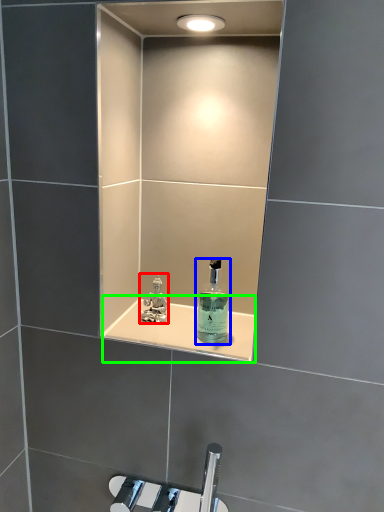
Question: Considering the real-world distances, which object is closest to perfume (highlighted by a red box)? bottle (highlighted by a blue box) or shelve (highlighted by a green box).

Choices:
 (A) bottle
 (B) shelve

Answer: (B)